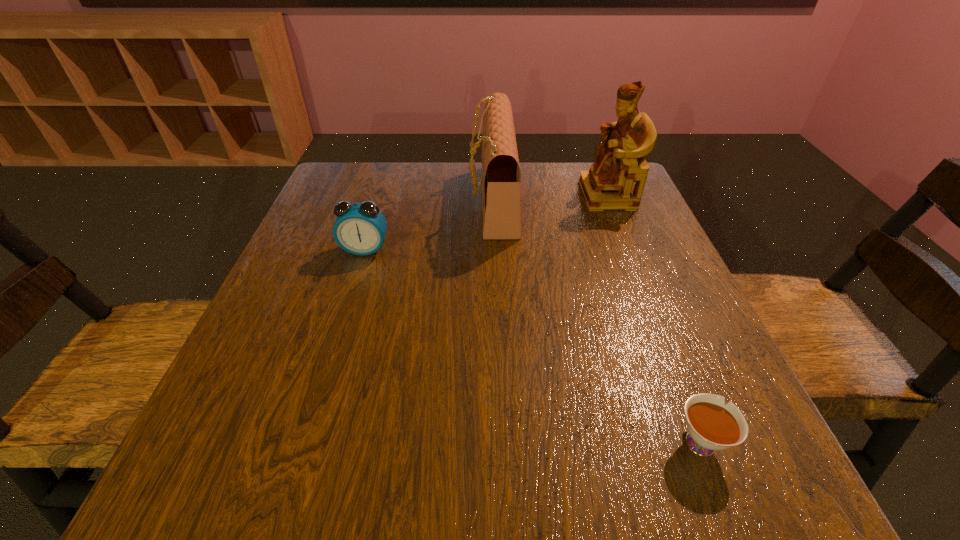
Image resolution: width=960 pixels, height=540 pixels. I want to click on free space located 0.160m on the front-facing side of the handbag, so click(x=404, y=200).

At what (x,y) coordinates should I click in order to perform the action: click on vacant point located on the front-facing side of the handbag. Please return your answer as a coordinate pair (x, y). Looking at the image, I should click on (412, 200).

What are the coordinates of `vacant region located 0.180m on the front-facing side of the handbag` in the screenshot? It's located at (396, 200).

Find the location of `vacant position located 0.360m on the face of the second shortest object`. vacant position located 0.360m on the face of the second shortest object is located at coordinates (314, 413).

Locate an element on the screen. blank space located on the side of the nearest object with the handle is located at coordinates (670, 367).

Where is `free space located 0.220m on the side of the nearest object with the handle`? The image size is (960, 540). free space located 0.220m on the side of the nearest object with the handle is located at coordinates pyautogui.click(x=646, y=305).

Locate an element on the screen. vacant region located on the side of the nearest object with the handle is located at coordinates (662, 348).

The width and height of the screenshot is (960, 540). Find the location of `figurine that is at the far edge`. figurine that is at the far edge is located at coordinates (620, 161).

The height and width of the screenshot is (540, 960). I want to click on handbag situated at the far edge, so click(501, 178).

The image size is (960, 540). Find the location of `object that is at the near edge`. object that is at the near edge is located at coordinates (712, 425).